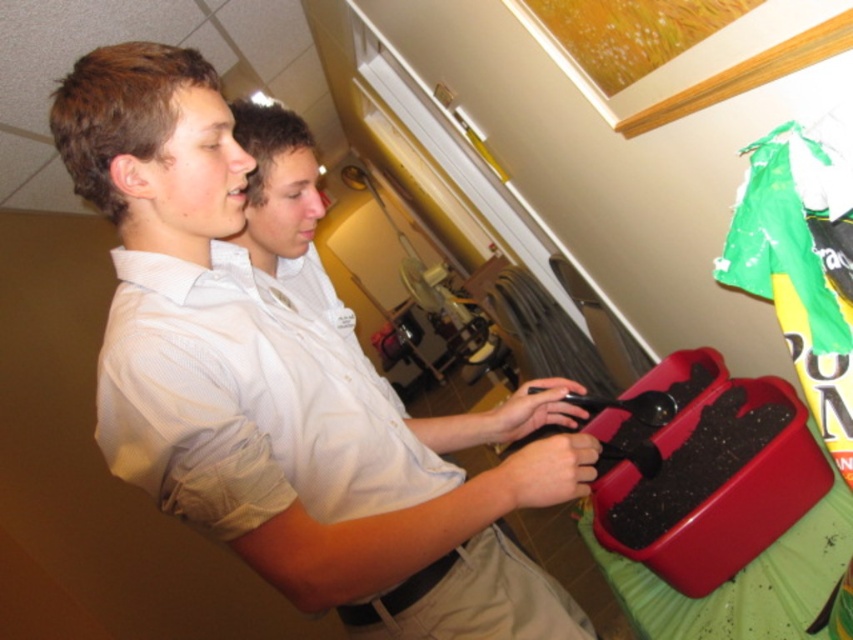
From the picture: Can you confirm if white cotton shirt at center is positioned below khaki cotton pants at lower center?

No.

Is white cotton shirt at center taller than khaki cotton pants at lower center?

Indeed, white cotton shirt at center has a greater height compared to khaki cotton pants at lower center.

Between point (318, 506) and point (373, 630), which one is positioned behind?

Point (373, 630)

Find the location of a particular element. The height and width of the screenshot is (640, 853). white cotton shirt at center is located at coordinates (248, 397).

Looking at this image, does white matte shirt at center appear under khaki cotton pants at lower center?

No.

Does point (386, 582) come farther from viewer compared to point (490, 618)?

No, (386, 582) is closer to viewer.

Does point (135, 216) lie behind point (495, 618)?

No.

At what (x,y) coordinates should I click in order to perform the action: click on white matte shirt at center. Please return your answer as a coordinate pair (x, y). This screenshot has width=853, height=640. Looking at the image, I should click on (286, 390).

Does white matte shirt at center have a greater width compared to white cotton shirt at center?

Correct, the width of white matte shirt at center exceeds that of white cotton shirt at center.

Who is more forward, (231, 444) or (392, 394)?

Point (231, 444)

Between point (474, 420) and point (107, 452), which one is positioned in front?

Point (107, 452) is more forward.

Locate an element on the screen. Image resolution: width=853 pixels, height=640 pixels. white matte shirt at center is located at coordinates (286, 390).